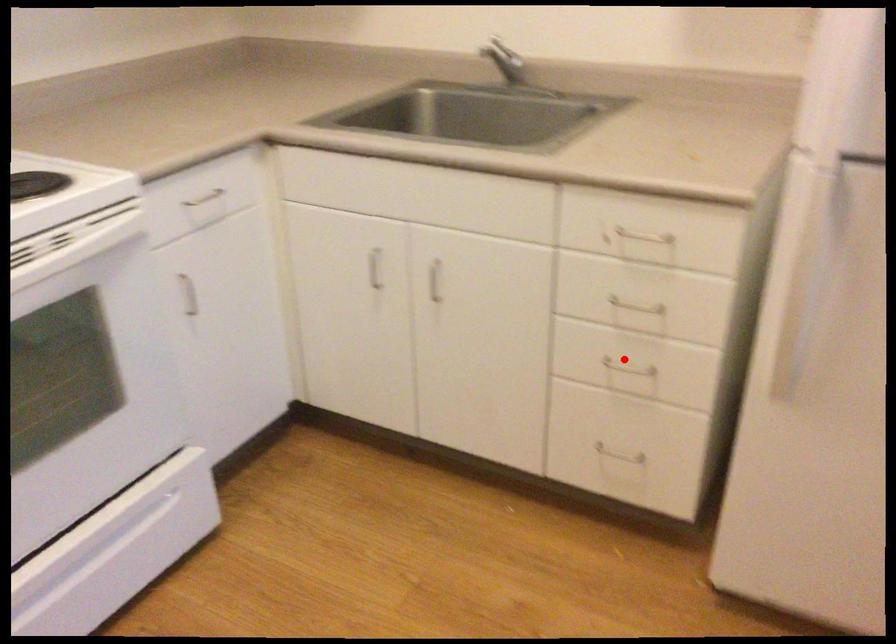
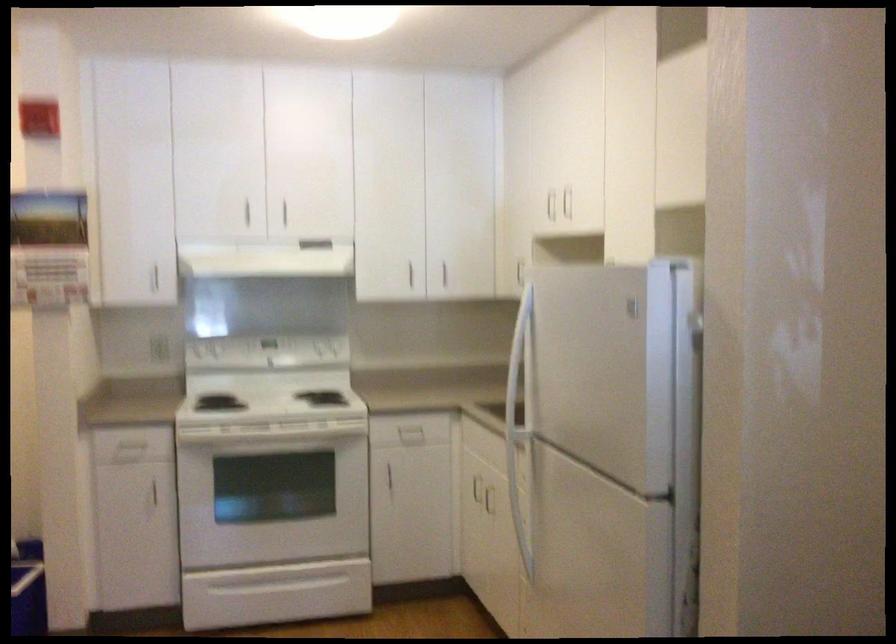
Question: I am providing you with two images of the same scene from different viewpoints. A red point is marked on the first image. At the location where the point appears in image 1, is it still visible in image 2?

Choices:
 (A) Yes
 (B) No

Answer: (B)